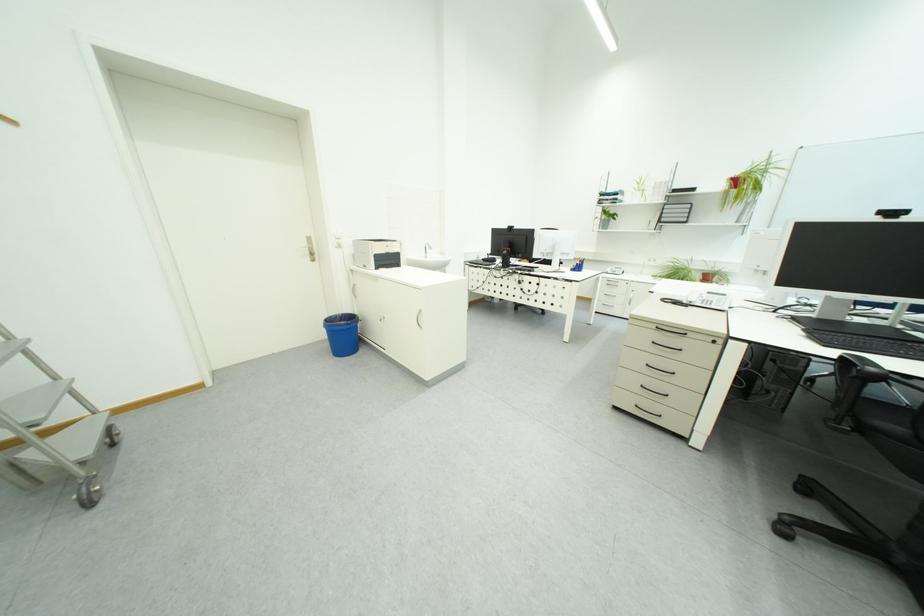
What do you see at coordinates (892, 213) in the screenshot? I see `the black webcam` at bounding box center [892, 213].